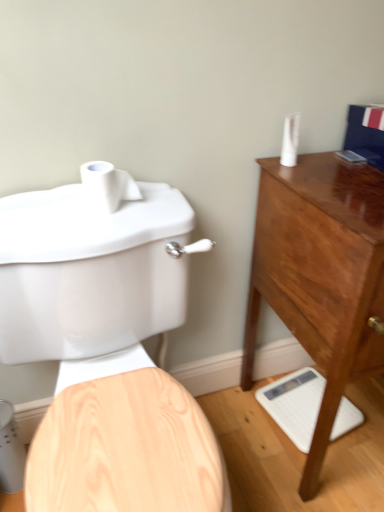
Find the location of `free spot above white glossy scale at lower right (from a real-world perspective)`. free spot above white glossy scale at lower right (from a real-world perspective) is located at coordinates (306, 398).